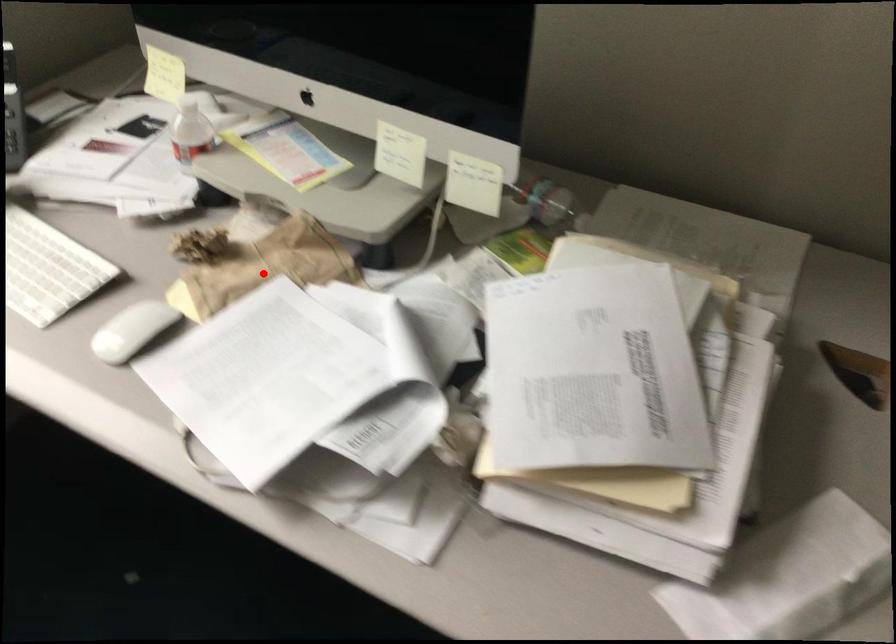
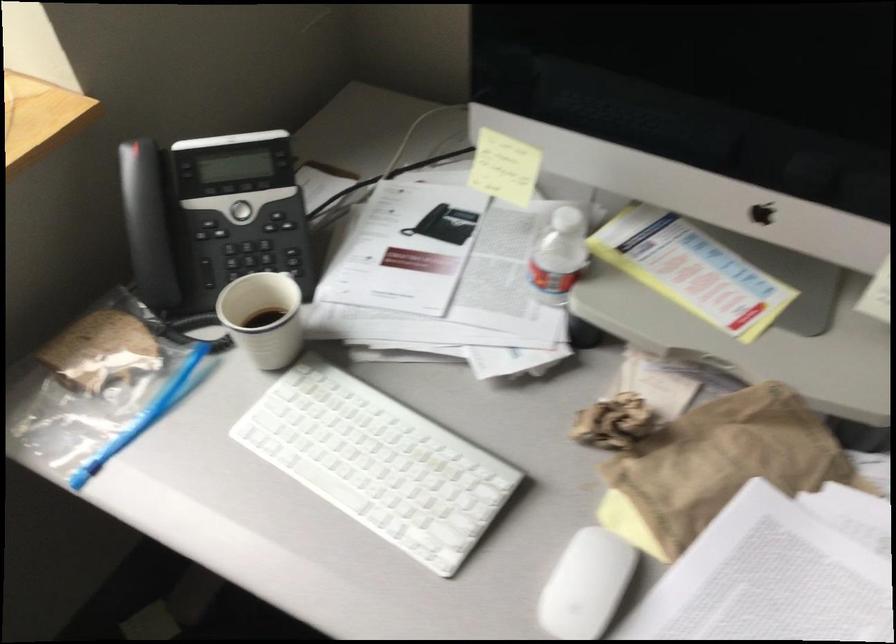
Question: I am providing you with two images of the same scene from different viewpoints. A red point is shown in image1. For the corresponding object point in image2, is it positioned nearer or farther from the camera?

Choices:
 (A) Nearer
 (B) Farther

Answer: (A)